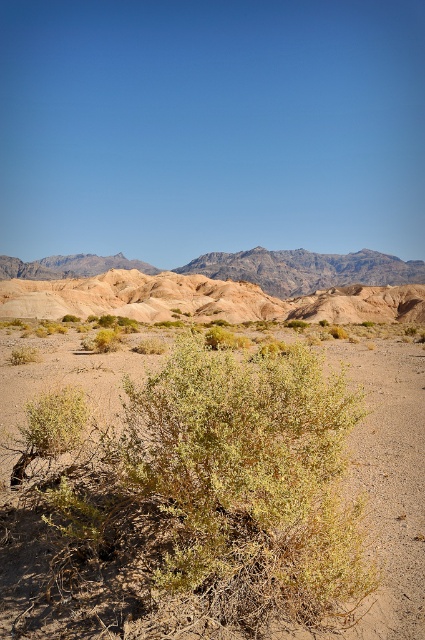
You are a desert explorer standing at the base of the rugged sandstone mountain at upper center and the brown sandy bush at center. Which object would cast a longer shadow during midday?

The rugged sandstone mountain at upper center would cast a longer shadow than the brown sandy bush at center because it is taller.

You are standing in the desert and see the brown sandy bush at center and the rugged sandstone mountain at upper center. Which object is positioned to the right of the other?

The brown sandy bush at center is to the right of rugged sandstone mountain at upper center.

From the picture: You are a hiker planning to cross the desert. You see the brown sandy bush at center and the rugged sandstone mountain at upper center. Which one is taller?

The rugged sandstone mountain at upper center is taller than the brown sandy bush at center.